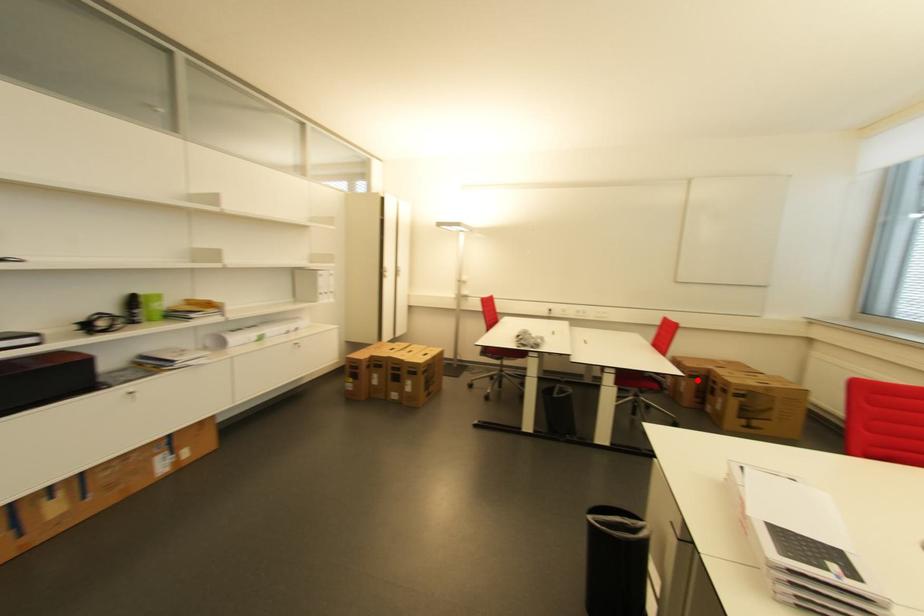
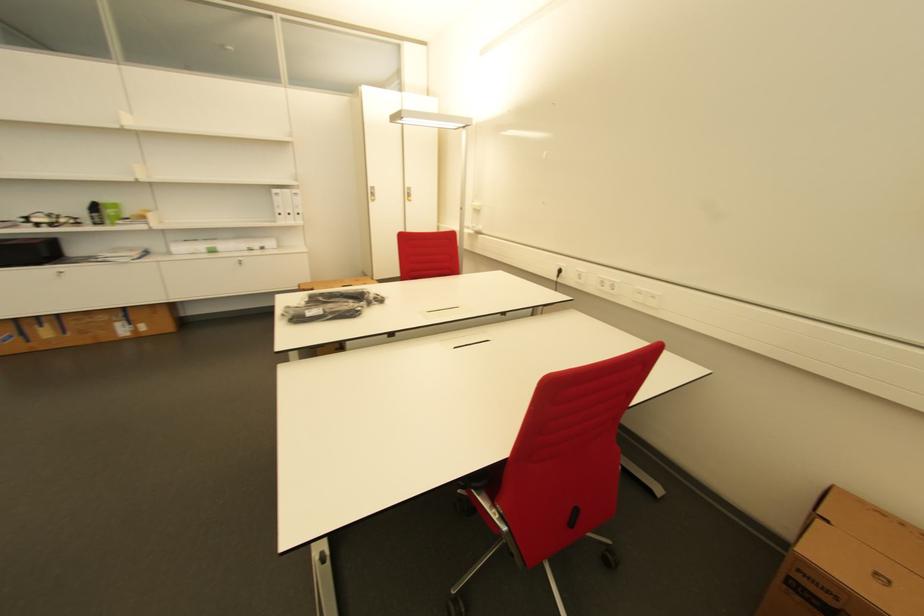
Question: I am providing you with two images of the same scene from different viewpoints. In image1, a red point is highlighted. Considering the same 3D point in image2, which of the following is correct?

Choices:
 (A) It is closer
 (B) It is farther

Answer: (A)